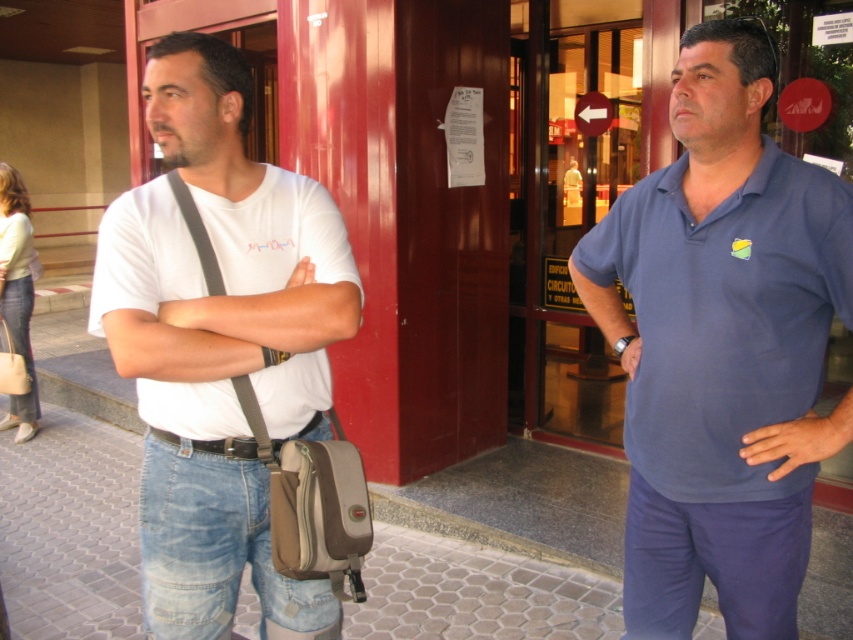
Based on the photo, does jeans at center appear under jeans at left?

Correct, jeans at center is located below jeans at left.

Between point (254, 576) and point (9, 298), which one is positioned behind?

The point (9, 298) is behind.

Does point (257, 520) lie in front of point (10, 397)?

That is True.

Identify the location of jeans at center. (194, 538).

Who is taller, jeans at center or blue fabric arm at right?

blue fabric arm at right

Is jeans at center below blue fabric arm at right?

Yes.

Image resolution: width=853 pixels, height=640 pixels. What are the coordinates of `jeans at center` in the screenshot? It's located at (194, 538).

Identify the location of jeans at center. The width and height of the screenshot is (853, 640). (194, 538).

Is white matte t-shirt at center smaller than jeans at center?

Incorrect, white matte t-shirt at center is not smaller in size than jeans at center.

Consider the image. Who is shorter, white matte t-shirt at center or jeans at center?

Standing shorter between the two is jeans at center.

This screenshot has width=853, height=640. I want to click on white matte t-shirt at center, so click(219, 344).